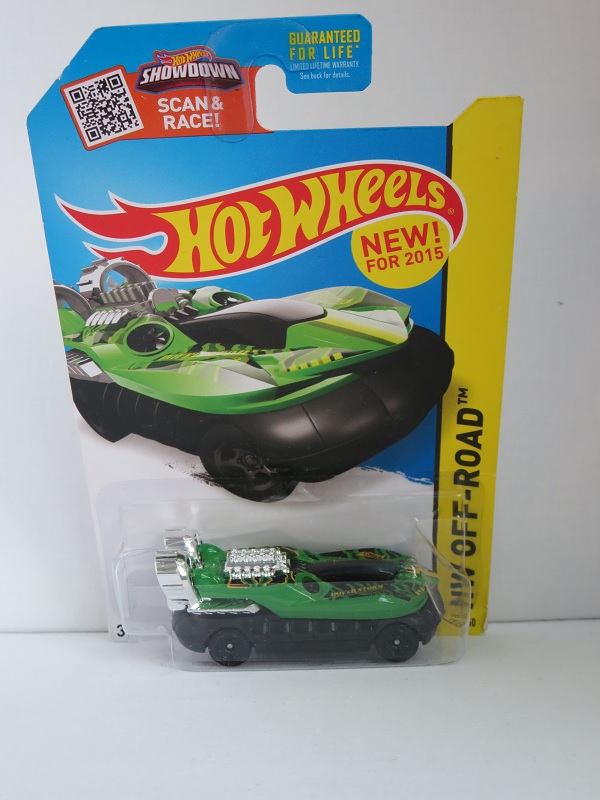
In order to click on white wall in this screenshot , I will do `click(576, 473)`.